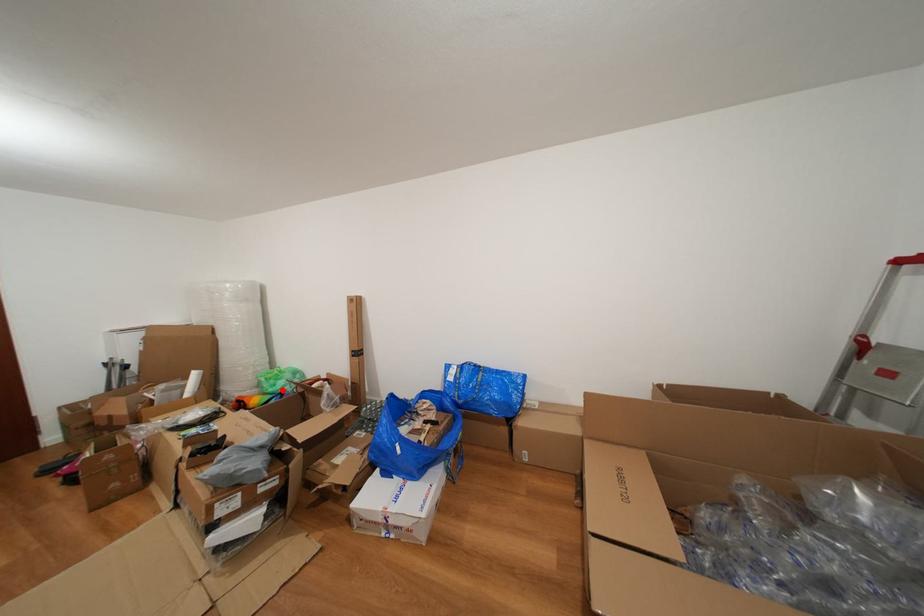
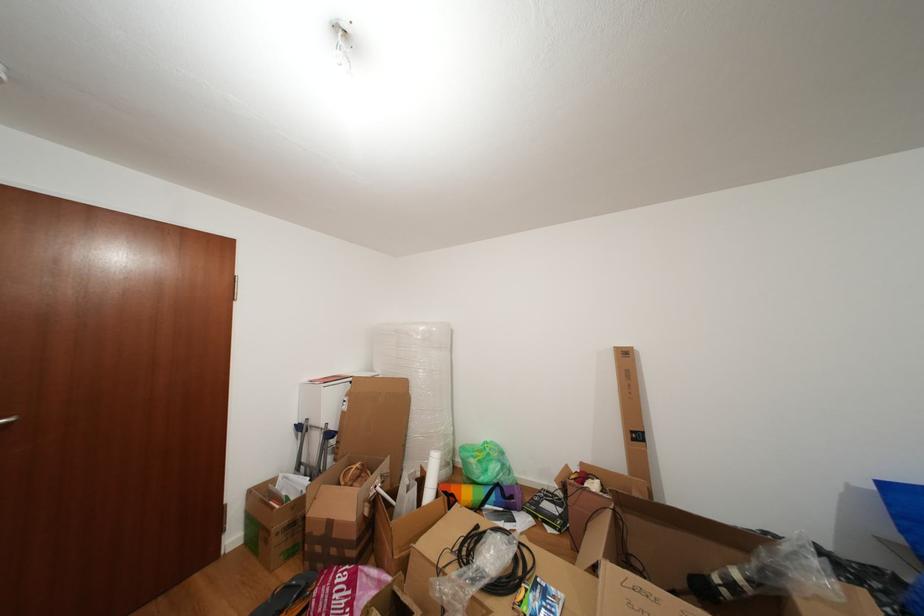
Question: I am providing you with two images of the same scene from different viewpoints. Given a red point in image1, look at the same physical point in image2. Is it:

Choices:
 (A) Closer to the viewpoint
 (B) Farther from the viewpoint

Answer: (B)